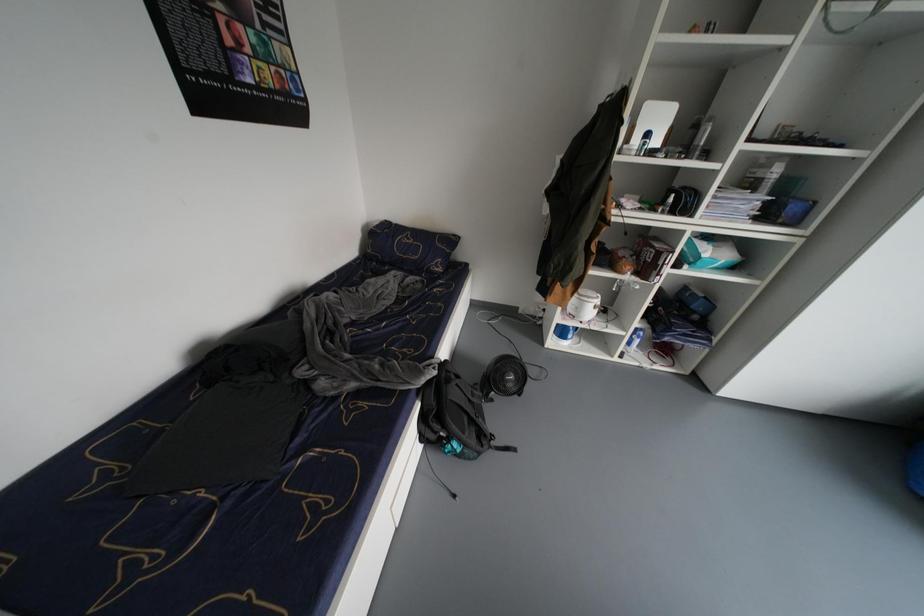
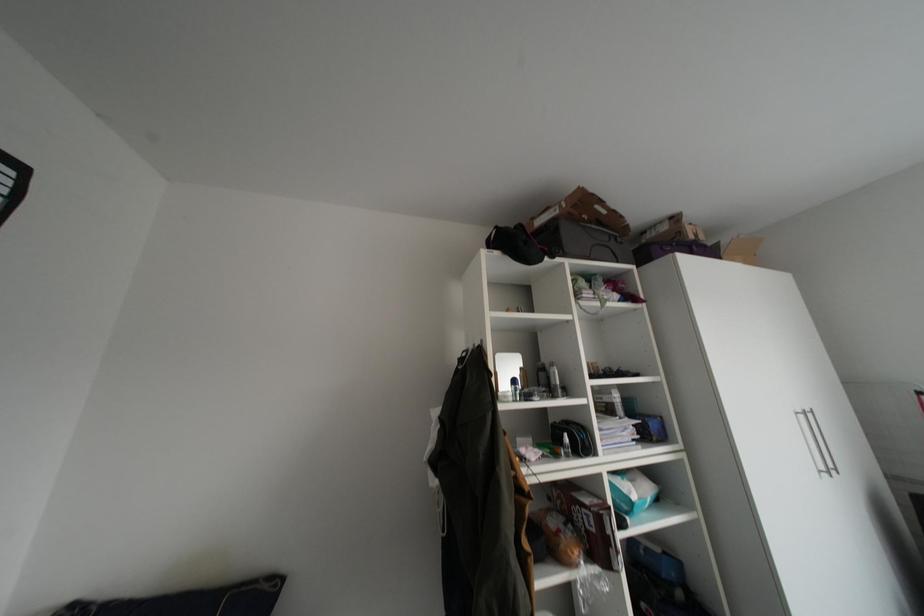
How did the camera likely rotate?

The rotation direction of the camera is right-up.